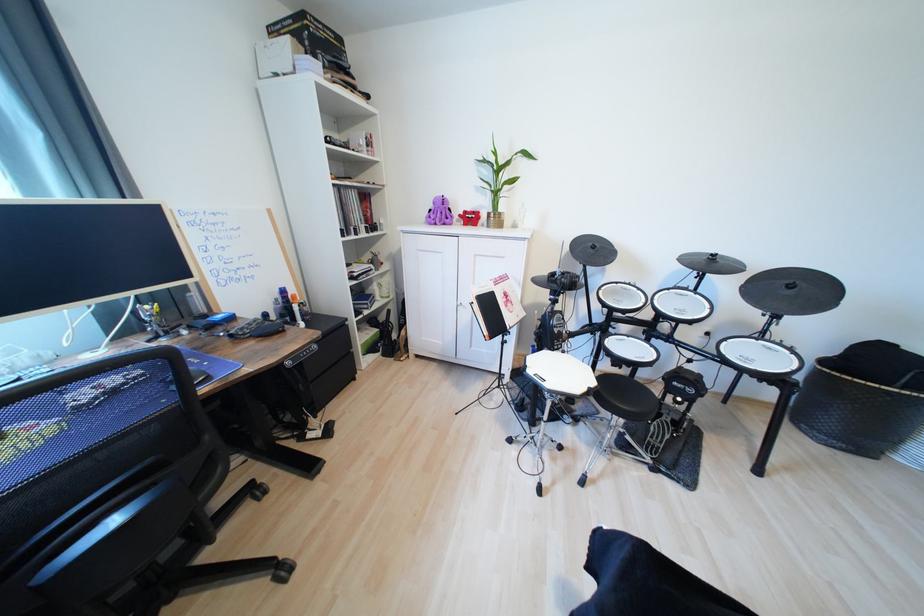
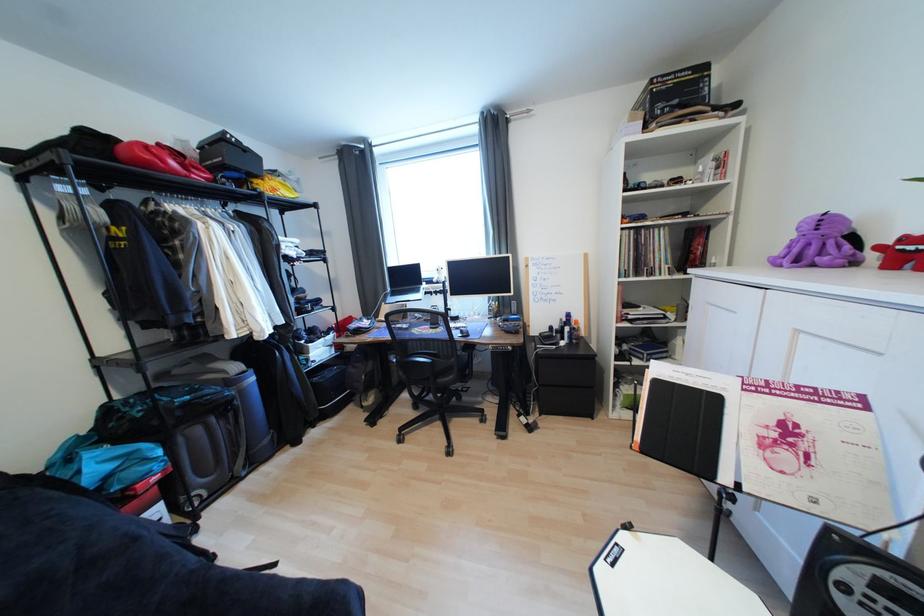
Question: The camera is either moving clockwise (left) or counter-clockwise (right) around the object. The first image is from the beginning of the video and the second image is from the end. Is the camera moving left or right when shooting the video?

Choices:
 (A) Left
 (B) Right

Answer: (B)